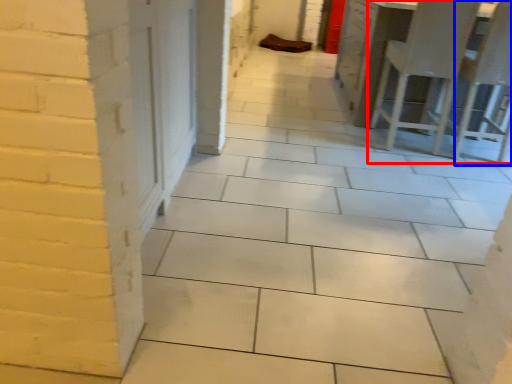
Question: Which object appears farthest to the camera in this image, furniture (highlighted by a red box) or chair (highlighted by a blue box)?

Choices:
 (A) furniture
 (B) chair

Answer: (A)